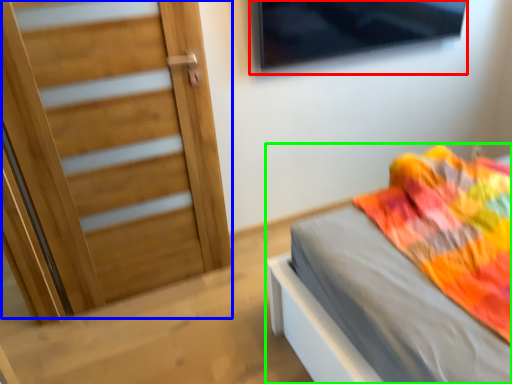
Question: Which is farther away from window (highlighted by a red box)? door (highlighted by a blue box) or bed (highlighted by a green box)?

Choices:
 (A) door
 (B) bed

Answer: (B)